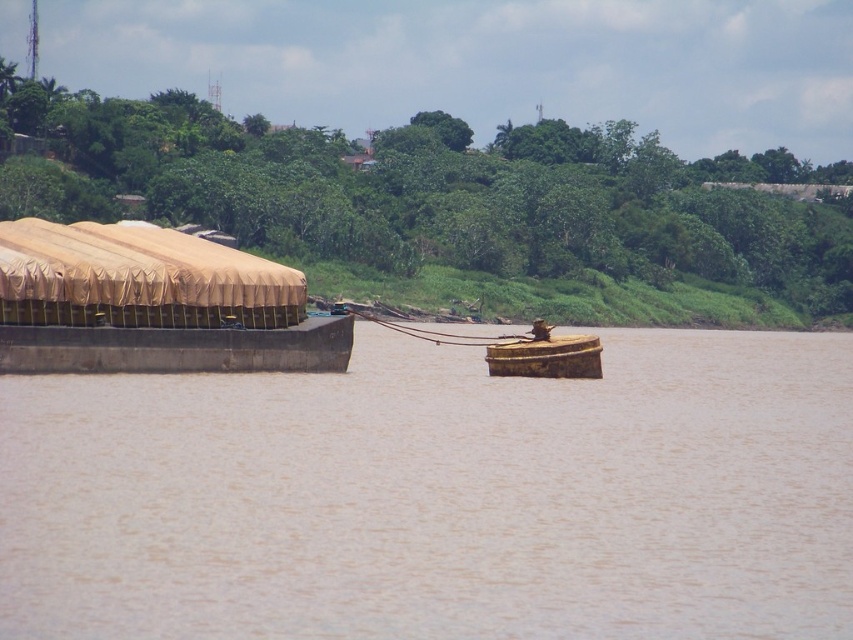
You are a delivery person who needs to load a package onto the boat. Given that the package requires a minimum width of 3 meters to be safely placed, and you know the brown matte barge at left is wider than the tan canvas boat at left, which vessel should you choose to ensure the package fits?

The brown matte barge at left has a greater width than the tan canvas boat at left, so the package should be placed on the brown matte barge at left to ensure it meets the minimum width requirement.

What are the coordinates of the brown matte barge at left in the image?

The brown matte barge at left is located at coordinates point [439,496].

You are a delivery person on the river and need to choose a vessel to transport a heavy crate. The brown matte barge at left and the tan canvas boat at left are available. Which vessel can carry the heavy crate based on their sizes?

The brown matte barge at left is larger in size than the tan canvas boat at left, so it can carry the heavy crate.